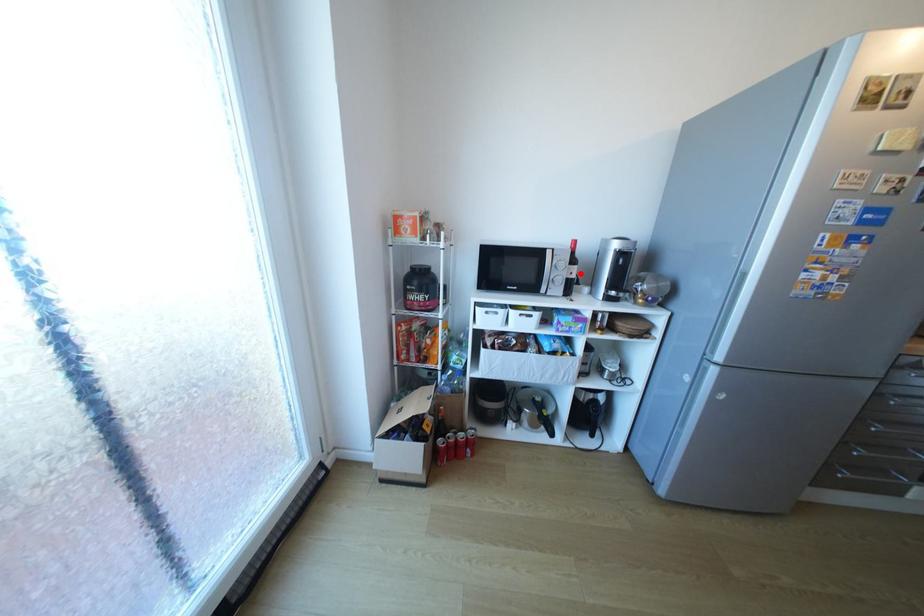
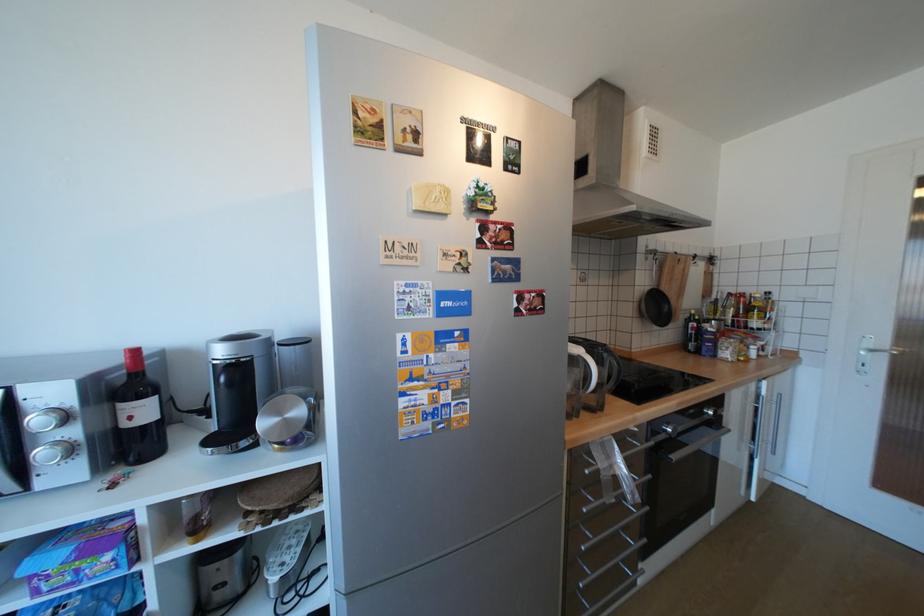
The point at the highlighted location is marked in the first image. Where is the corresponding point in the second image?

(140, 418)